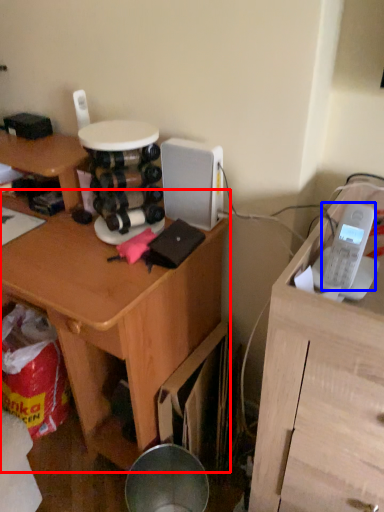
Question: Which of the following is the closest to the observer, desk (highlighted by a red box) or ipod (highlighted by a blue box)?

Choices:
 (A) desk
 (B) ipod

Answer: (B)